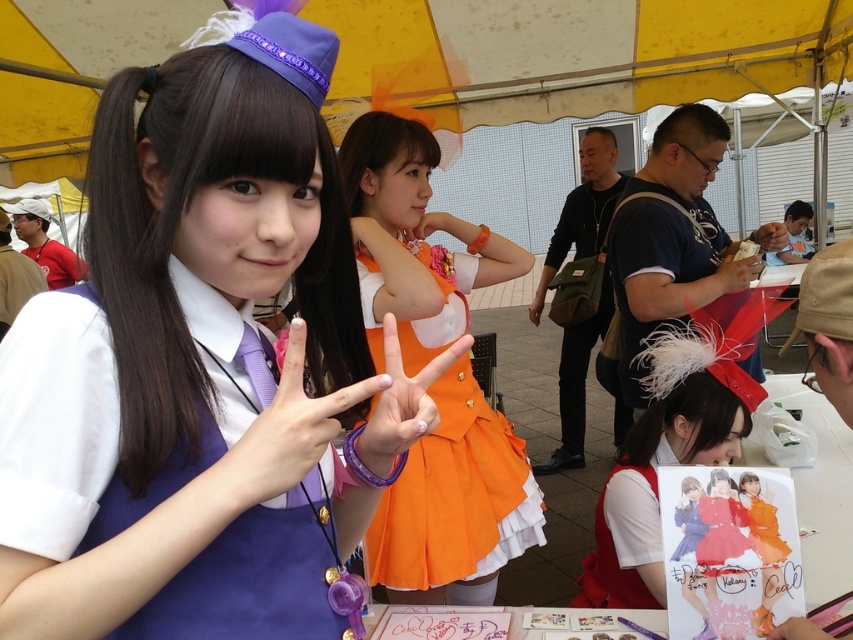
You are a photographer standing at a distance of 24 inches from the subject. You want to take a closeup shot of the matte purple dress at center. Is the dress within your current shooting range?

The matte purple dress at center is 23.19 inches away from the camera, which is within the photographer standing at 24 inches distance. Therefore, the dress is within the shooting range.

You are a photographer standing 2 meters away from the scene. You want to capture a photo that includes both the matte orange dress at center and the matte brown hand at center without any cropping. What is the minimum focal length lens you should use?

The minimum focal length lens required is approximately 50mm. This ensures that both the matte orange dress at center and the matte brown hand at center, which are 1.14 meters apart, can be captured in the frame without cropping when you are 2 meters away.